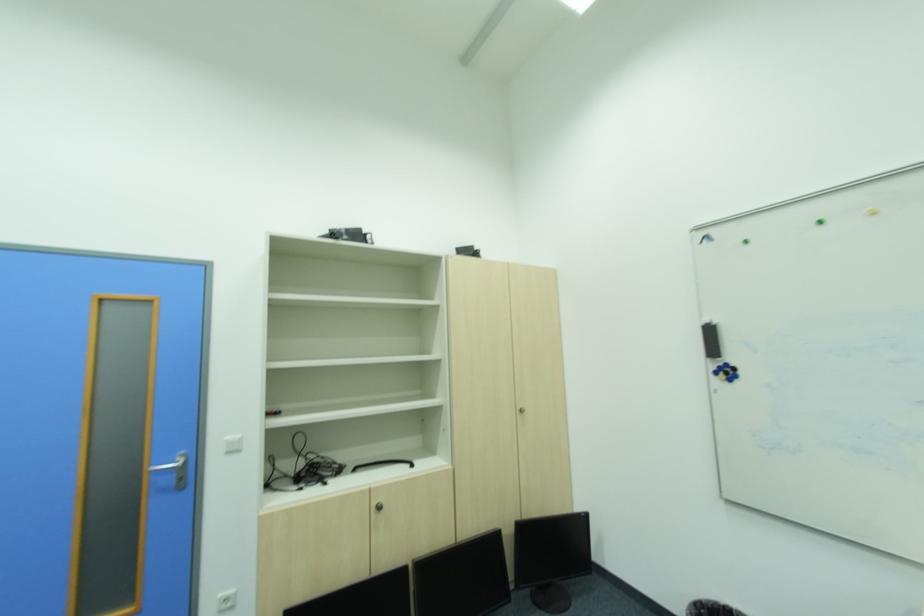
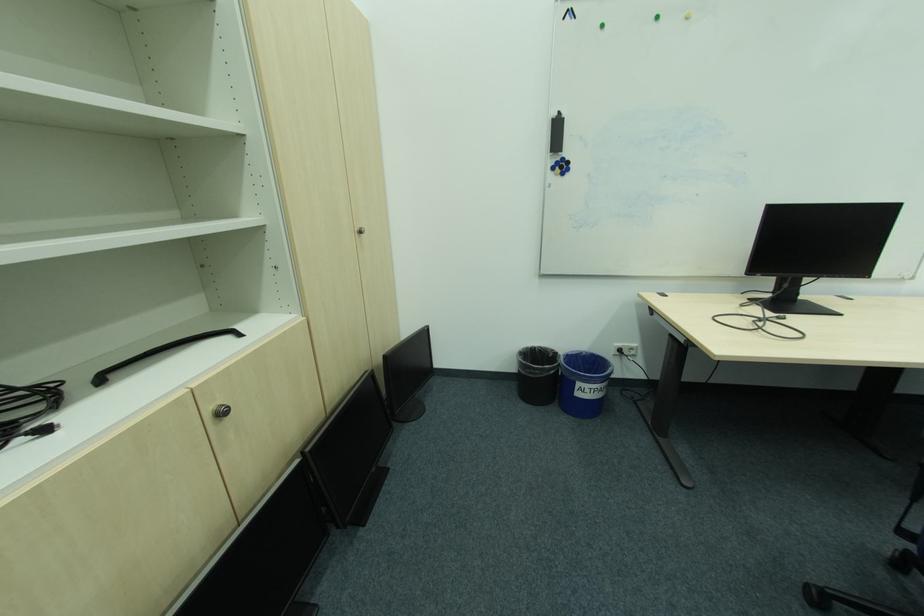
Locate, in the second image, the point that corresponds to (x=526, y=408) in the first image.

(363, 229)